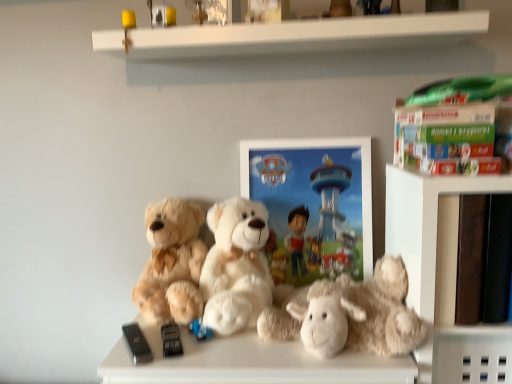
The image size is (512, 384). I want to click on free space above matte plastic picture frame at center (from a real-world perspective), so click(308, 132).